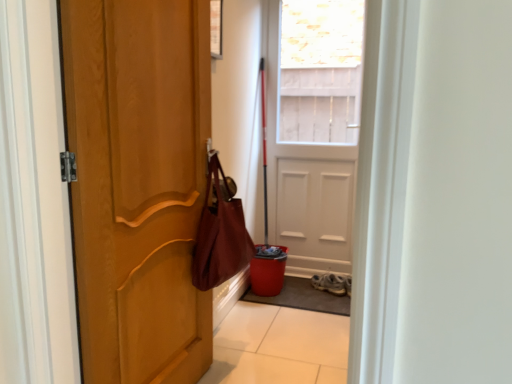
Where is `free point above gray textured mat at lower center (from a real-world perspective)`? This screenshot has width=512, height=384. free point above gray textured mat at lower center (from a real-world perspective) is located at coordinates (321, 288).